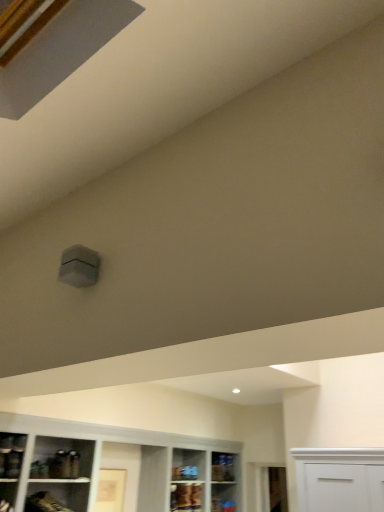
Question: Looking at their shapes, would you say matte brown shelf at lower left, acting as the second shelf starting from the left, is wider or thinner than clear glass shelf at lower center, the 3th shelf when ordered from front to back?

Choices:
 (A) wide
 (B) thin

Answer: (A)

Question: Does point click(72, 507) appear closer or farther from the camera than point click(216, 480)?

Choices:
 (A) farther
 (B) closer

Answer: (B)

Question: Which object is positioned closest to the matte brown cabinet at lower center?

Choices:
 (A) matte glass shelf at lower left, arranged as the first shelf when viewed from the front
 (B) matte brown shelf at lower left, the second shelf when ordered from front to back
 (C) clear glass shelf at lower center, the 3th shelf when ordered from front to back

Answer: (C)

Question: Estimate the real-world distances between objects in this image. Which object is farther from the matte brown shelf at lower left, which appears as the second shelf when viewed from the right?

Choices:
 (A) clear glass shelf at lower center, positioned as the 3th shelf in top-to-bottom order
 (B) matte glass shelf at lower left, the 3th shelf in the bottom-to-top sequence
 (C) matte brown cabinet at lower center

Answer: (A)